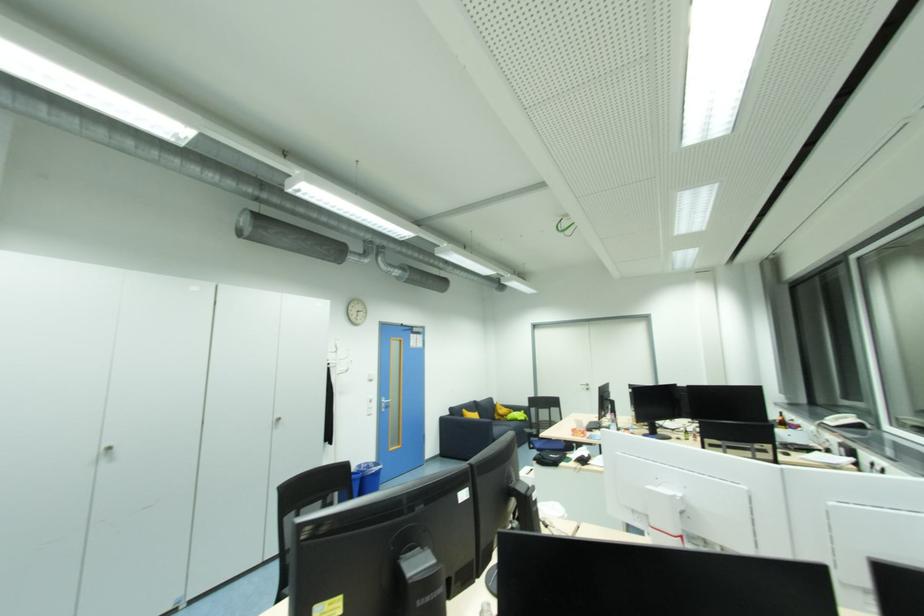
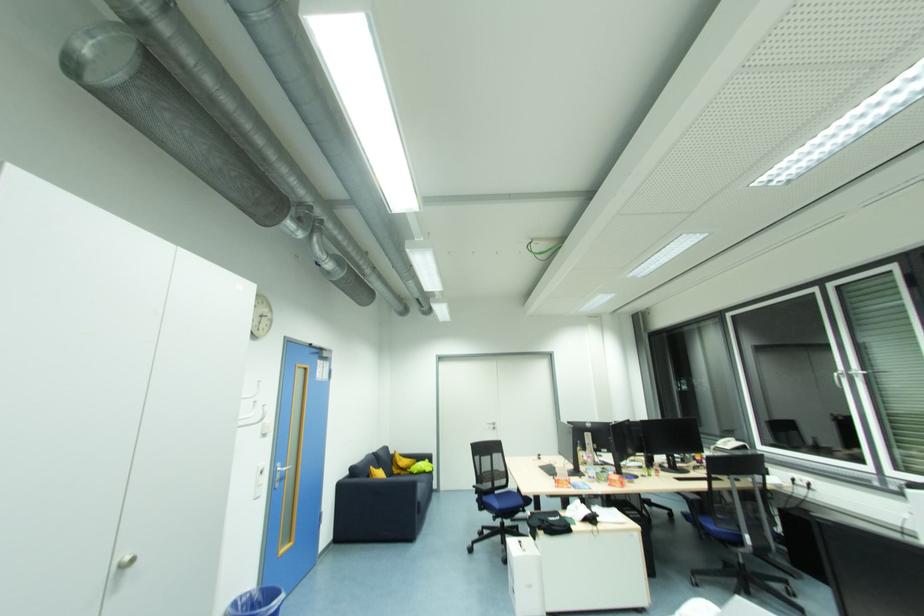
The point at (562, 410) is marked in the first image. Where is the corresponding point in the second image?

(504, 456)